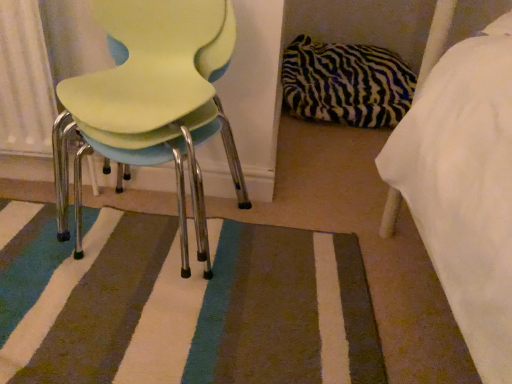
The height and width of the screenshot is (384, 512). I want to click on zebra-patterned pillow at center-right, so click(x=346, y=83).

This screenshot has width=512, height=384. Identify the location of striped carpet at center. (181, 304).

Image resolution: width=512 pixels, height=384 pixels. What are the coordinates of `matte plastic chair at left` in the screenshot? It's located at (152, 103).

Locate an element on the screen. The width and height of the screenshot is (512, 384). zebra-patterned pillow at center-right is located at coordinates (346, 83).

Who is shorter, zebra-patterned pillow at center-right or matte plastic chair at left?

zebra-patterned pillow at center-right.

From a real-world perspective, is zebra-patterned pillow at center-right physically below matte plastic chair at left?

Indeed, from a real-world perspective, zebra-patterned pillow at center-right is positioned beneath matte plastic chair at left.

Is the surface of zebra-patterned pillow at center-right in direct contact with matte plastic chair at left?

No, zebra-patterned pillow at center-right is not in contact with matte plastic chair at left.

Based on their sizes in the image, would you say matte plastic chair at left is bigger or smaller than striped carpet at center?

In the image, matte plastic chair at left appears to be larger than striped carpet at center.

From the image's perspective, is matte plastic chair at left above or below striped carpet at center?

matte plastic chair at left is above striped carpet at center.

How distant is matte plastic chair at left from striped carpet at center?

They are 10.04 inches apart.

Does matte plastic chair at left have a lesser height compared to striped carpet at center?

No.

Is matte plastic chair at left at the back of striped carpet at center?

Yes, striped carpet at center is facing away from matte plastic chair at left.

From the image's perspective, between striped carpet at center and matte plastic chair at left, who is located below?

striped carpet at center is shown below in the image.

Who is shorter, striped carpet at center or matte plastic chair at left?

striped carpet at center.

Considering the relative sizes of striped carpet at center and matte plastic chair at left in the image provided, is striped carpet at center bigger than matte plastic chair at left?

Incorrect, striped carpet at center is not larger than matte plastic chair at left.

Does zebra-patterned pillow at center-right have a greater height compared to striped carpet at center?

Yes.

You are a GUI agent. You are given a task and a screenshot of the screen. Output one action in this format:
    pyautogui.click(x=<x>, y=<y>)
    Task: Click on the material above the striped carpet at center (from the image's perspective)
    
    Given the screenshot: What is the action you would take?
    pyautogui.click(x=346, y=83)

Does zebra-patterned pillow at center-right contain striped carpet at center?

No, striped carpet at center is not surrounded by zebra-patterned pillow at center-right.

From the image's perspective, would you say zebra-patterned pillow at center-right is shown under striped carpet at center?

Actually, zebra-patterned pillow at center-right appears above striped carpet at center in the image.

Can you confirm if matte plastic chair at left is bigger than zebra-patterned pillow at center-right?

Actually, matte plastic chair at left might be smaller than zebra-patterned pillow at center-right.

Would you say matte plastic chair at left is a long distance from zebra-patterned pillow at center-right?

Absolutely, matte plastic chair at left is distant from zebra-patterned pillow at center-right.

Is matte plastic chair at left aimed at zebra-patterned pillow at center-right?

No, matte plastic chair at left is not oriented towards zebra-patterned pillow at center-right.

Is striped carpet at center facing away from zebra-patterned pillow at center-right?

No, striped carpet at center is not facing the opposite direction of zebra-patterned pillow at center-right.

Can you tell me how much striped carpet at center and zebra-patterned pillow at center-right differ in facing direction?

0.58 degrees.

The height and width of the screenshot is (384, 512). I want to click on material on the right of striped carpet at center, so click(346, 83).

Consider the image. Is striped carpet at center in contact with zebra-patterned pillow at center-right?

No, striped carpet at center is not making contact with zebra-patterned pillow at center-right.

Where is `chair on the left of the zebra-patterned pillow at center-right`? The width and height of the screenshot is (512, 384). chair on the left of the zebra-patterned pillow at center-right is located at coordinates (152, 103).

The image size is (512, 384). In the image, there is a matte plastic chair at left. What are the coordinates of `mat below it (from the image's perspective)` in the screenshot? It's located at (181, 304).

From the image, which object appears to be nearer to striped carpet at center, matte plastic chair at left or zebra-patterned pillow at center-right?

matte plastic chair at left is closer to striped carpet at center.

Estimate the real-world distances between objects in this image. Which object is closer to zebra-patterned pillow at center-right, striped carpet at center or matte plastic chair at left?

The object closer to zebra-patterned pillow at center-right is matte plastic chair at left.

Estimate the real-world distances between objects in this image. Which object is closer to matte plastic chair at left, striped carpet at center or zebra-patterned pillow at center-right?

striped carpet at center.

Which object lies further to the anchor point zebra-patterned pillow at center-right, matte plastic chair at left or striped carpet at center?

striped carpet at center is further to zebra-patterned pillow at center-right.

Which object lies further to the anchor point striped carpet at center, zebra-patterned pillow at center-right or matte plastic chair at left?

zebra-patterned pillow at center-right lies further to striped carpet at center than the other object.

From the image, which object appears to be nearer to matte plastic chair at left, zebra-patterned pillow at center-right or striped carpet at center?

striped carpet at center is closer to matte plastic chair at left.

Find the location of a particular element. This screenshot has width=512, height=384. mat between matte plastic chair at left and zebra-patterned pillow at center-right in the front-back direction is located at coordinates (181, 304).